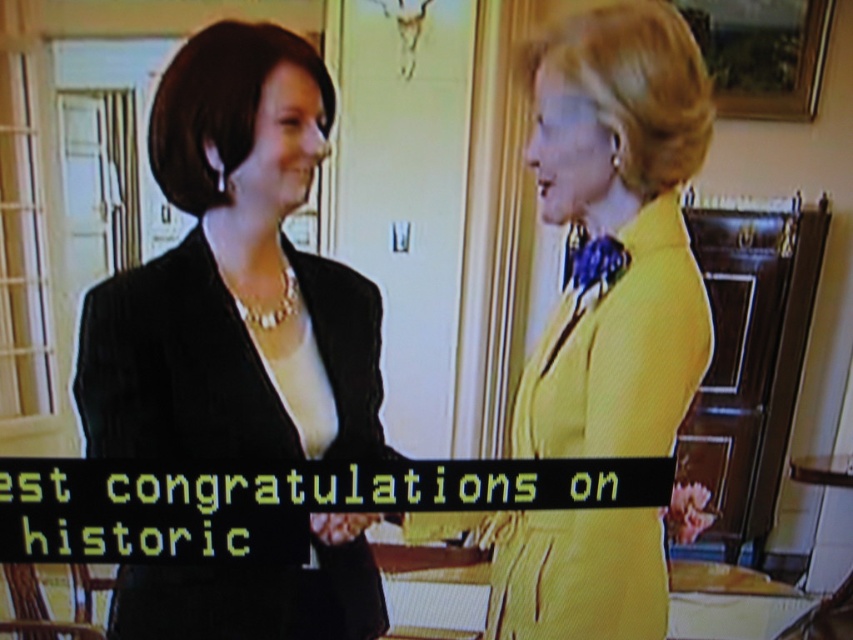
From the picture: Is matte black blazer at center to the right of yellow textured dress at right from the viewer's perspective?

No, matte black blazer at center is not to the right of yellow textured dress at right.

Who is more distant from viewer, (183, 160) or (573, 557)?

The point (573, 557) is behind.

You are a GUI agent. You are given a task and a screenshot of the screen. Output one action in this format:
    pyautogui.click(x=<x>, y=<y>)
    Task: Click on the matte black blazer at center
    
    Given the screenshot: What is the action you would take?
    pyautogui.click(x=234, y=276)